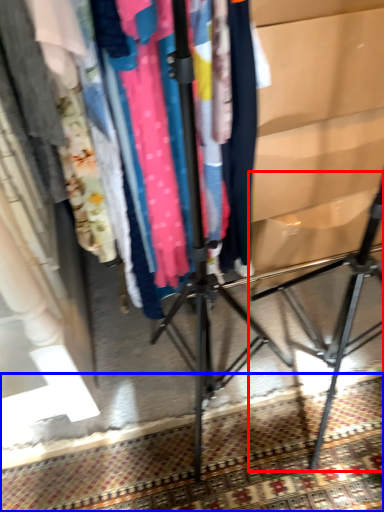
Question: Which of the following is the farthest to the observer, tripod (highlighted by a red box) or mat (highlighted by a blue box)?

Choices:
 (A) tripod
 (B) mat

Answer: (B)